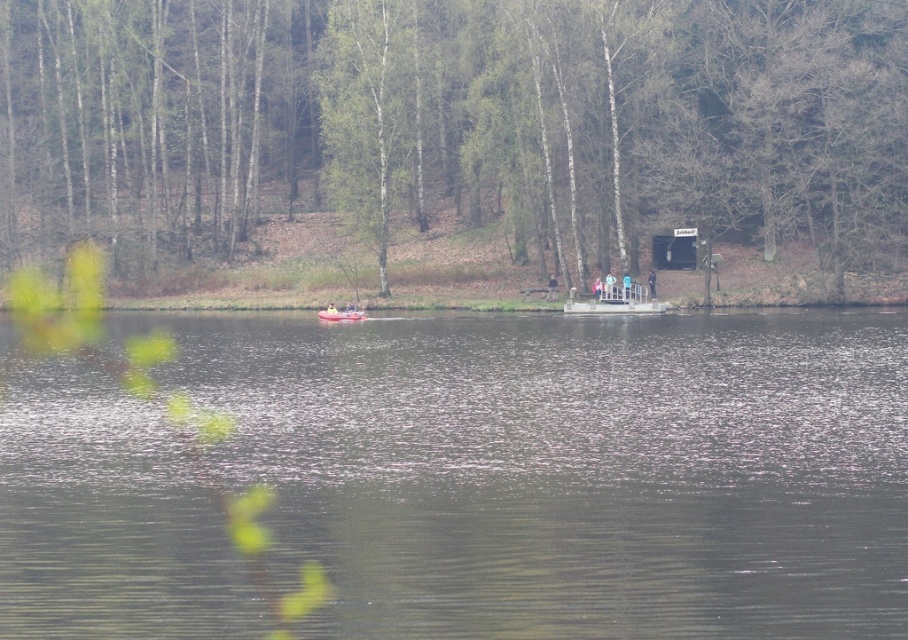
Can you confirm if green matte tree at center is positioned to the right of rubber boat at center?

Indeed, green matte tree at center is positioned on the right side of rubber boat at center.

I want to click on green matte tree at center, so click(x=457, y=122).

Locate an element on the screen. The image size is (908, 640). green matte tree at center is located at coordinates (457, 122).

Which is below, white plastic boat at center or rubber boat at center?

rubber boat at center

Can you confirm if white plastic boat at center is shorter than rubber boat at center?

No, white plastic boat at center is not shorter than rubber boat at center.

Is point (627, 296) closer to viewer compared to point (341, 308)?

That is False.

Where is `white plastic boat at center`? The image size is (908, 640). white plastic boat at center is located at coordinates (617, 300).

Is the position of transparent water at center less distant than that of rubber boat at center?

Yes, transparent water at center is closer to the viewer.

Between transparent water at center and rubber boat at center, which one appears on the right side from the viewer's perspective?

From the viewer's perspective, transparent water at center appears more on the right side.

Locate an element on the screen. The width and height of the screenshot is (908, 640). transparent water at center is located at coordinates (471, 477).